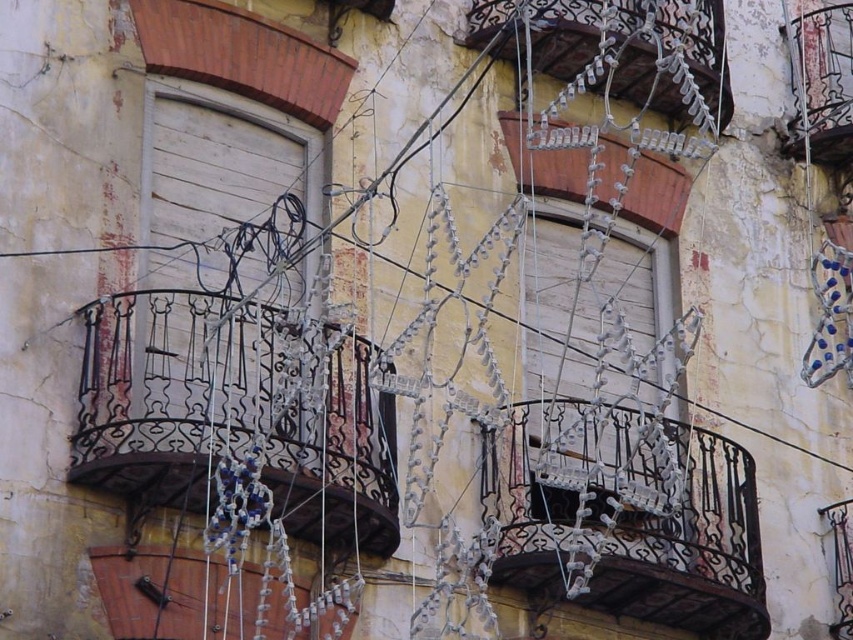
Question: Can you confirm if rusty wrought iron balcony at center is bigger than metallic wire balcony at lower left?

Choices:
 (A) no
 (B) yes

Answer: (B)

Question: Which point is farther from the camera taking this photo?

Choices:
 (A) tap(546, 532)
 (B) tap(303, 602)
 (C) tap(822, 81)
 (D) tap(129, 387)

Answer: (C)

Question: Which point is farther from the camera taking this photo?

Choices:
 (A) (103, 589)
 (B) (216, 432)
 (C) (660, 83)
 (D) (827, 38)

Answer: (D)

Question: Considering the real-world distances, which object is farthest from the wrought iron balcony at upper right?

Choices:
 (A) rusty wrought iron balcony at center
 (B) metallic wire balcony at lower left
 (C) black wrought iron balcony at left
 (D) white metallic balcony at upper center

Answer: (B)

Question: Is rusty wrought iron balcony at center closer to the viewer compared to white metallic balcony at upper center?

Choices:
 (A) no
 (B) yes

Answer: (B)

Question: Does rusty wrought iron balcony at center appear on the right side of metallic wire balcony at lower left?

Choices:
 (A) yes
 (B) no

Answer: (A)